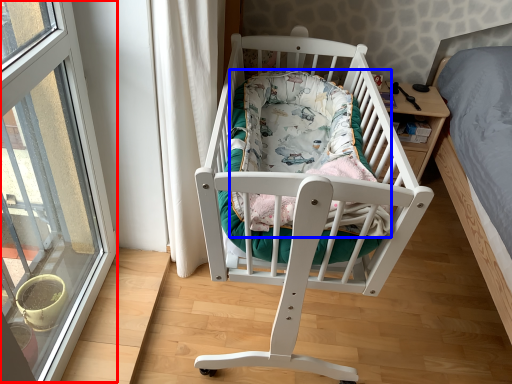
Question: Which of the following is the closest to the observer, window (highlighted by a red box) or mattress (highlighted by a blue box)?

Choices:
 (A) window
 (B) mattress

Answer: (A)